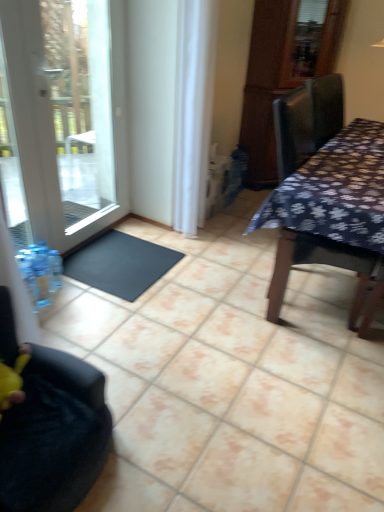
The image size is (384, 512). Describe the element at coordinates (64, 117) in the screenshot. I see `white glass door at left` at that location.

Identify the location of white glass door at left. The width and height of the screenshot is (384, 512). (64, 117).

The height and width of the screenshot is (512, 384). In order to click on black fabric chair at lower left in this screenshot , I will do `click(54, 435)`.

You are a GUI agent. You are given a task and a screenshot of the screen. Output one action in this format:
    pyautogui.click(x=<x>, y=<y>)
    Task: Click on the white sheer curtain at center
    The image size is (384, 512).
    Given the screenshot: What is the action you would take?
    pyautogui.click(x=193, y=111)

Considering the positions of objects black fabric chair at lower left and black rubber doormat at lower left in the image provided, who is more to the right, black fabric chair at lower left or black rubber doormat at lower left?

black rubber doormat at lower left is more to the right.

From the picture: From the image's perspective, who appears lower, black fabric chair at lower left or black rubber doormat at lower left?

black fabric chair at lower left appears lower in the image.

In order to click on doormat behind the black fabric chair at lower left in this screenshot , I will do `click(120, 264)`.

Is black fabric chair at lower left not within black rubber doormat at lower left?

Yes, black fabric chair at lower left is located beyond the bounds of black rubber doormat at lower left.

Is white sheer curtain at center touching dark floral fabric table at right?

white sheer curtain at center is not next to dark floral fabric table at right, and they're not touching.

Is white sheer curtain at center positioned in front of dark floral fabric table at right?

No.

Could you tell me if white sheer curtain at center is facing dark floral fabric table at right?

Yes, white sheer curtain at center is turned towards dark floral fabric table at right.

Which is more to the left, black rubber doormat at lower left or dark floral fabric table at right?

Positioned to the left is black rubber doormat at lower left.

Is black rubber doormat at lower left in front of or behind dark floral fabric table at right in the image?

Visually, black rubber doormat at lower left is located behind dark floral fabric table at right.

Choose the correct answer: Is black rubber doormat at lower left inside dark floral fabric table at right or outside it?

black rubber doormat at lower left is not enclosed by dark floral fabric table at right.

Based on the photo, which is closer, (x=72, y=254) or (x=371, y=172)?

Point (x=72, y=254).

Looking at their sizes, would you say dark floral fabric table at right is wider or thinner than white glass door at left?

In the image, dark floral fabric table at right appears to be wider than white glass door at left.

Can you confirm if dark floral fabric table at right is smaller than white glass door at left?

No.

This screenshot has width=384, height=512. Identify the location of table directly beneath the white glass door at left (from a real-world perspective). (331, 214).

In terms of height, does white glass door at left look taller or shorter compared to white sheer curtain at center?

Clearly, white glass door at left is shorter compared to white sheer curtain at center.

Can you confirm if white glass door at left is smaller than white sheer curtain at center?

Yes, white glass door at left is smaller than white sheer curtain at center.

Does point (23, 12) appear closer or farther from the camera than point (199, 226)?

Point (23, 12) is closer to the camera than point (199, 226).

Is white glass door at left positioned beyond the bounds of black fabric chair at lower left?

white glass door at left lies outside black fabric chair at lower left's area.

Is white glass door at left at the right side of black fabric chair at lower left?

Incorrect, white glass door at left is not on the right side of black fabric chair at lower left.

Is white glass door at left bigger than black fabric chair at lower left?

No, white glass door at left is not bigger than black fabric chair at lower left.

Considering the points (106, 162) and (111, 421), which point is behind, point (106, 162) or point (111, 421)?

The point (106, 162) is behind.

Based on the photo, does white sheer curtain at center have a greater width compared to white glass door at left?

Indeed, white sheer curtain at center has a greater width compared to white glass door at left.

In the scene shown: From the image's perspective, is white sheer curtain at center positioned above or below white glass door at left?

white sheer curtain at center is situated higher than white glass door at left in the image.

Is white glass door at left completely or partially inside white sheer curtain at center?

Definitely not — white glass door at left is not inside white sheer curtain at center.

From the picture: Between white sheer curtain at center and white glass door at left, which one has smaller size?

With smaller size is white glass door at left.

The width and height of the screenshot is (384, 512). Identify the location of doormat that is on the right side of black fabric chair at lower left. (120, 264).

Locate an element on the screen. The height and width of the screenshot is (512, 384). table below the white sheer curtain at center (from a real-world perspective) is located at coordinates (331, 214).

Considering their positions, is white sheer curtain at center positioned further to black rubber doormat at lower left than white glass door at left?

white sheer curtain at center.

Based on their spatial positions, is black rubber doormat at lower left or black fabric chair at lower left further from dark floral fabric table at right?

Based on the image, black fabric chair at lower left appears to be further to dark floral fabric table at right.

When comparing their distances from dark floral fabric table at right, does white sheer curtain at center or black rubber doormat at lower left seem further?

The object further to dark floral fabric table at right is black rubber doormat at lower left.

Based on their spatial positions, is white glass door at left or white sheer curtain at center further from black fabric chair at lower left?

Among the two, white sheer curtain at center is located further to black fabric chair at lower left.

In the scene shown: Estimate the real-world distances between objects in this image. Which object is closer to black rubber doormat at lower left, white glass door at left or white sheer curtain at center?

white glass door at left lies closer to black rubber doormat at lower left than the other object.

Which object lies nearer to the anchor point white sheer curtain at center, black rubber doormat at lower left or dark floral fabric table at right?

black rubber doormat at lower left is closer to white sheer curtain at center.

Looking at the image, which one is located closer to white glass door at left, black fabric chair at lower left or white sheer curtain at center?

Among the two, white sheer curtain at center is located nearer to white glass door at left.

Looking at the image, which one is located further to black rubber doormat at lower left, white sheer curtain at center or black fabric chair at lower left?

black fabric chair at lower left lies further to black rubber doormat at lower left than the other object.

The image size is (384, 512). In order to click on curtain between black rubber doormat at lower left and dark floral fabric table at right in this screenshot , I will do `click(193, 111)`.

Find the location of a particular element. The width and height of the screenshot is (384, 512). doormat between black fabric chair at lower left and dark floral fabric table at right is located at coordinates (120, 264).

In order to click on curtain between black fabric chair at lower left and black rubber doormat at lower left from front to back in this screenshot , I will do `click(193, 111)`.

Image resolution: width=384 pixels, height=512 pixels. I want to click on door between white sheer curtain at center and black rubber doormat at lower left in the up-down direction, so click(x=64, y=117).